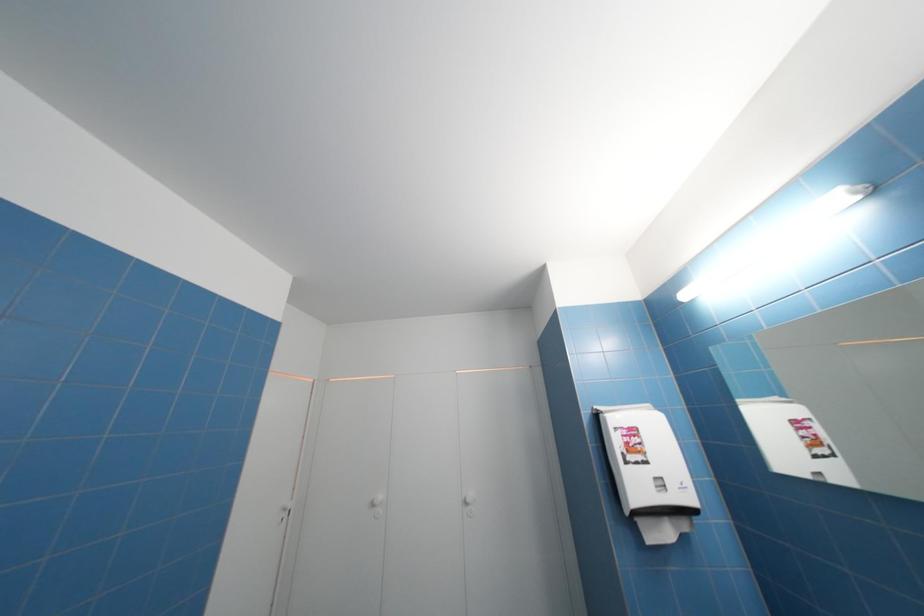
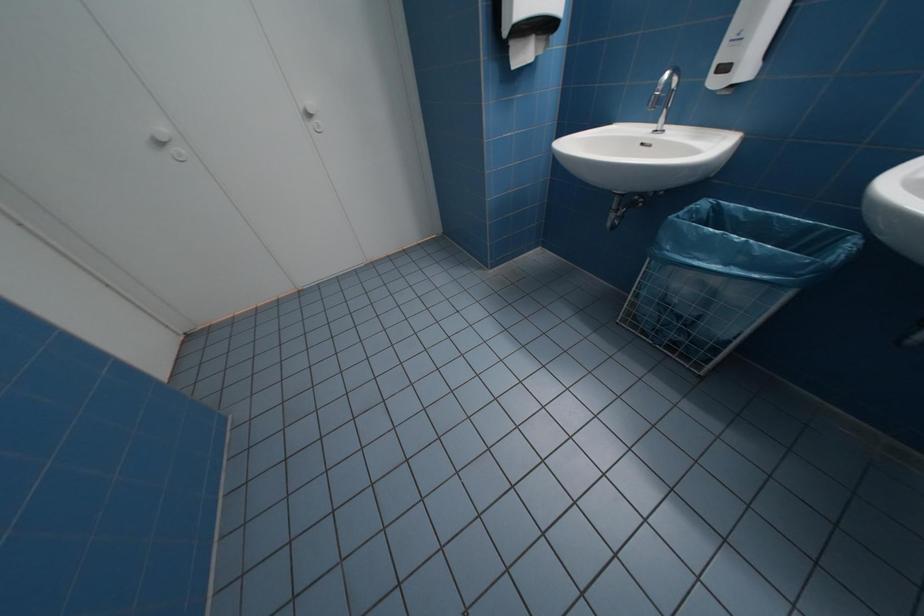
The images are taken continuously from a first-person perspective. In which direction is your viewpoint rotating?

The rotation direction of the camera is right-down.